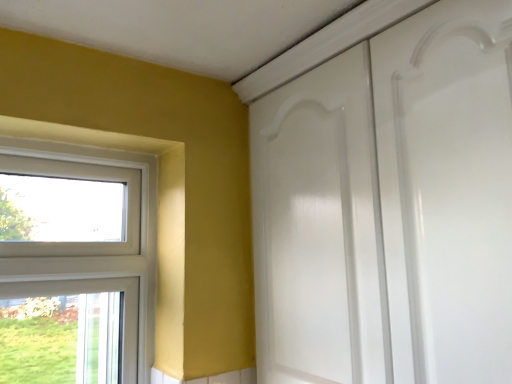
Image resolution: width=512 pixels, height=384 pixels. I want to click on white glossy cabinet doors at upper right, so click(x=390, y=207).

This screenshot has width=512, height=384. What do you see at coordinates (390, 207) in the screenshot?
I see `white glossy cabinet doors at upper right` at bounding box center [390, 207].

Identify the location of white glossy cabinet doors at upper right. (390, 207).